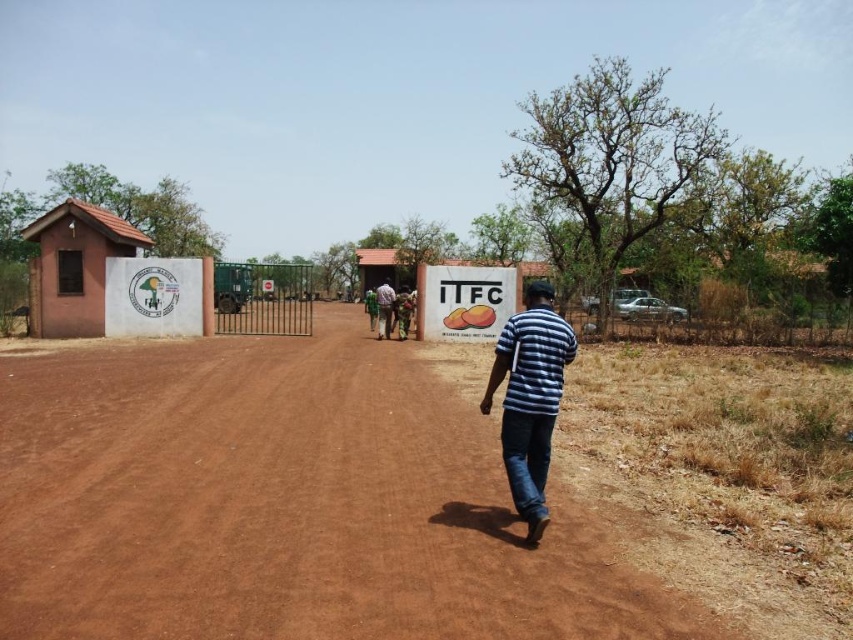
You are standing at the entrance of the ITFC building and want to walk towards the gate. There is a brown dirt track at center and a green fabric shirt at center in your view. Which object will you encounter first as you walk towards the gate?

The brown dirt track at center is closer to the viewer than the green fabric shirt at center, so you will encounter the brown dirt track at center first.

You are a visitor arriving at the ITFC facility and see the brown dirt track at center and the green fabric shirt at center. Which object is positioned to the right side from your perspective?

The brown dirt track at center is to the right of the green fabric shirt at center, so the brown dirt track at center is positioned to the right side.